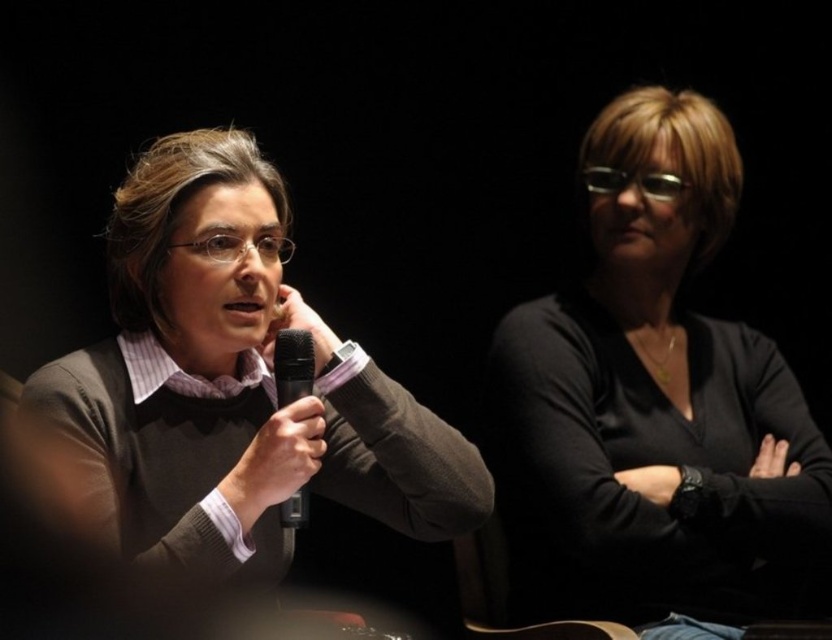
You are a photographer at a formal event. You need to adjust the lighting to highlight both the black matte shirt at upper right and the matte gray sweater at left. Since the background is dark, which object should you focus the light on first to ensure both are visible?

The black matte shirt at upper right is positioned on the right side of matte gray sweater at left. Since black absorbs more light, you should focus the light on the black matte shirt at upper right first to ensure it becomes visible, then adjust for the matte gray sweater at left.

You are designing a uniform for a team and need to ensure that the microphone fits comfortably under the sweater. Given the sizes of the matte gray sweater at left and the black matte microphone at center, will the microphone fit underneath the sweater without being too tight?

The matte gray sweater at left has a larger size compared to the black matte microphone at center, so the microphone should fit comfortably underneath the sweater without being too tight.

You are a photographer at the event and want to capture a photo where both the black matte shirt at upper right and the black matte microphone at center are clearly visible. Based on their positions, which object should be placed closer to the left side of the frame?

The black matte microphone at center should be placed closer to the left side of the frame since the black matte shirt at upper right is positioned to the right of it.